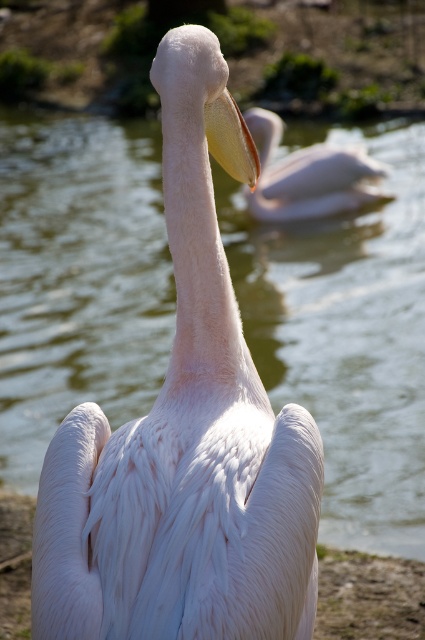
Based on the photo, who is higher up, white feathered pelican at center or white matte pelican at center?

white matte pelican at center

Is white feathered pelican at center bigger than white matte pelican at center?

No.

Is point (206, 490) closer to viewer compared to point (265, 138)?

Yes, point (206, 490) is in front of point (265, 138).

Locate an element on the screen. white feathered pelican at center is located at coordinates (186, 436).